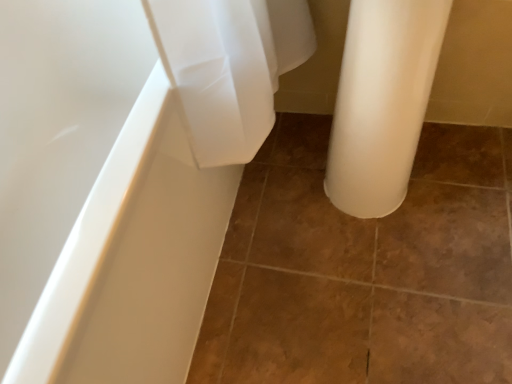
Locate an element on the screen. The height and width of the screenshot is (384, 512). matte white bathtub at left is located at coordinates (126, 173).

Measure the distance between point [239,136] and camera.

The distance of point [239,136] from camera is 82.10 centimeters.

This screenshot has width=512, height=384. What do you see at coordinates (126, 173) in the screenshot?
I see `matte white bathtub at left` at bounding box center [126, 173].

The height and width of the screenshot is (384, 512). I want to click on brown matte tile at center, so click(x=365, y=269).

What is the approximate width of brown matte tile at center?

brown matte tile at center is 30.46 inches in width.

Describe the element at coordinates (365, 269) in the screenshot. I see `brown matte tile at center` at that location.

Image resolution: width=512 pixels, height=384 pixels. What are the coordinates of `matte white bathtub at left` in the screenshot? It's located at (126, 173).

Which object is positioned more to the right, brown matte tile at center or matte white bathtub at left?

brown matte tile at center.

Is brown matte tile at center in front of or behind matte white bathtub at left in the image?

brown matte tile at center is positioned farther from the viewer than matte white bathtub at left.

Which point is more distant from viewer, (197, 341) or (65, 124)?

Positioned behind is point (65, 124).

In the scene shown: From the image's perspective, does brown matte tile at center appear higher than matte white bathtub at left?

No, from the image's perspective, brown matte tile at center is not over matte white bathtub at left.

Looking at this image, from a real-world perspective, is brown matte tile at center positioned under matte white bathtub at left based on gravity?

Yes, from a real-world perspective, brown matte tile at center is below matte white bathtub at left.

Which object is wider, brown matte tile at center or matte white bathtub at left?

brown matte tile at center.

Consider the image. Between brown matte tile at center and matte white bathtub at left, which one has less height?

Standing shorter between the two is brown matte tile at center.

Considering the sizes of objects brown matte tile at center and matte white bathtub at left in the image provided, who is bigger, brown matte tile at center or matte white bathtub at left?

Bigger between the two is matte white bathtub at left.

Is matte white bathtub at left a part of brown matte tile at center?

No, matte white bathtub at left is located outside of brown matte tile at center.

Is there a large distance between brown matte tile at center and matte white bathtub at left?

That's not correct — brown matte tile at center is a little close to matte white bathtub at left.

Is brown matte tile at center oriented towards matte white bathtub at left?

No, brown matte tile at center is not oriented towards matte white bathtub at left.

How different are the orientations of brown matte tile at center and matte white bathtub at left in degrees?

0.0386 degrees.

Locate an element on the screen. This screenshot has width=512, height=384. ceramic tile that appears below the matte white bathtub at left (from a real-world perspective) is located at coordinates (365, 269).

Is matte white bathtub at left to the right of brown matte tile at center from the viewer's perspective?

Incorrect, matte white bathtub at left is not on the right side of brown matte tile at center.

Considering the positions of objects matte white bathtub at left and brown matte tile at center in the image provided, who is in front, matte white bathtub at left or brown matte tile at center?

matte white bathtub at left is in front.

In the scene shown: Which is nearer, (x=151, y=347) or (x=287, y=191)?

The point (x=151, y=347) is in front.

From the image's perspective, is matte white bathtub at left below brown matte tile at center?

Actually, matte white bathtub at left appears above brown matte tile at center in the image.

From a real-world perspective, relative to brown matte tile at center, is matte white bathtub at left vertically above or below?

Clearly, from a real-world perspective, matte white bathtub at left is above brown matte tile at center.

Can you confirm if matte white bathtub at left is wider than brown matte tile at center?

No, matte white bathtub at left is not wider than brown matte tile at center.

From their relative heights in the image, would you say matte white bathtub at left is taller or shorter than brown matte tile at center?

matte white bathtub at left is taller than brown matte tile at center.

In terms of size, does matte white bathtub at left appear bigger or smaller than brown matte tile at center?

In the image, matte white bathtub at left appears to be larger than brown matte tile at center.

Can brown matte tile at center be found inside matte white bathtub at left?

No.

Looking at this image, are matte white bathtub at left and brown matte tile at center far apart?

No, matte white bathtub at left is in close proximity to brown matte tile at center.

Is brown matte tile at center at the back of matte white bathtub at left?

No, matte white bathtub at left is not facing away from brown matte tile at center.

How many degrees apart are the facing directions of matte white bathtub at left and brown matte tile at center?

matte white bathtub at left and brown matte tile at center are facing 0.0386 degrees away from each other.

How distant is matte white bathtub at left from brown matte tile at center?

37.42 centimeters.

Image resolution: width=512 pixels, height=384 pixels. Identify the location of bathtub lying in front of the brown matte tile at center. (126, 173).

At what (x,y) coordinates should I click in order to perform the action: click on ceramic tile directly beneath the matte white bathtub at left (from a real-world perspective). Please return your answer as a coordinate pair (x, y). Image resolution: width=512 pixels, height=384 pixels. Looking at the image, I should click on (365, 269).

This screenshot has width=512, height=384. In order to click on bathtub located above the brown matte tile at center (from a real-world perspective) in this screenshot , I will do `click(126, 173)`.